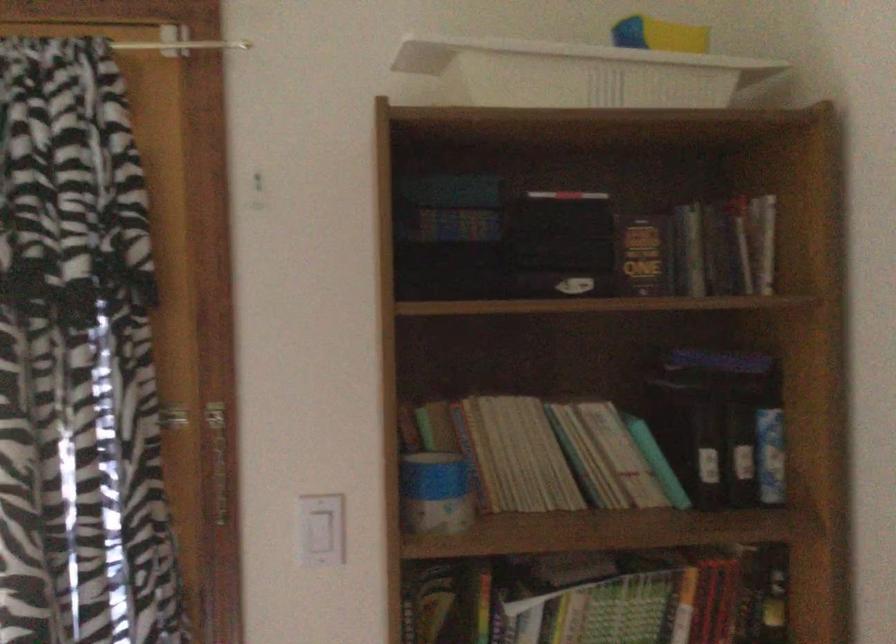
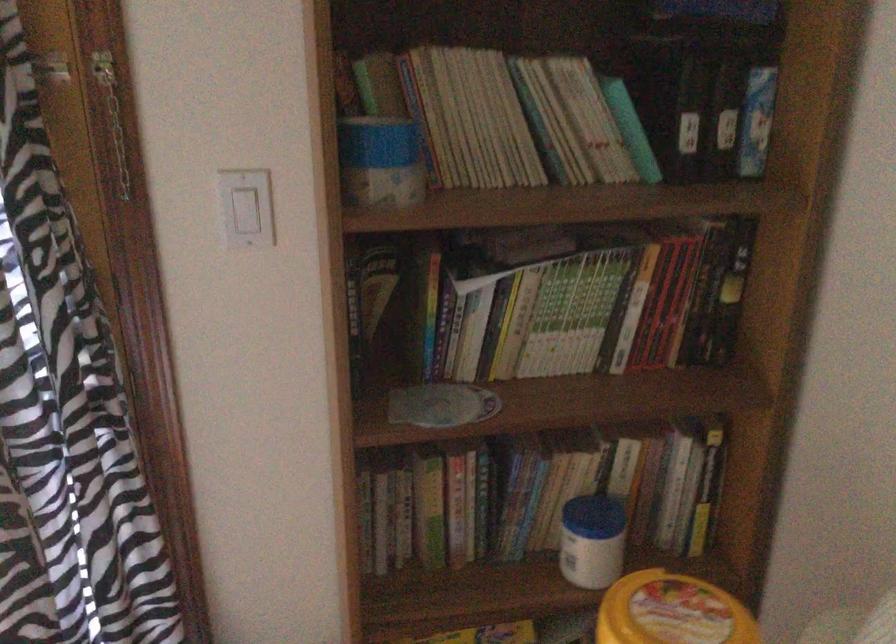
The point at (x=583, y=458) is marked in the first image. Where is the corresponding point in the second image?

(549, 124)